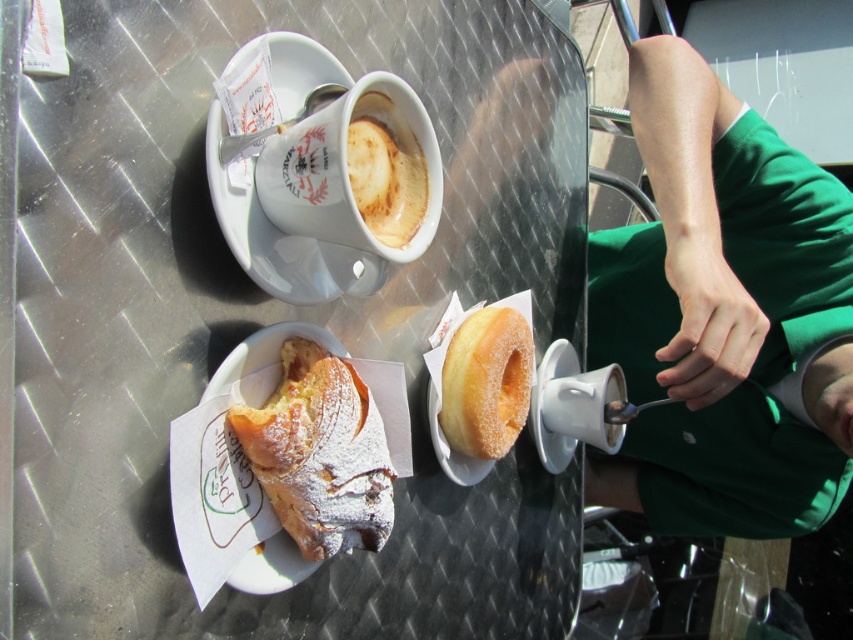
Who is positioned more to the left, metallic silver table at center or sugared doughnut at center?

Answer: From the viewer's perspective, metallic silver table at center appears more on the left side.

Describe the element at coordinates (274, 317) in the screenshot. Image resolution: width=853 pixels, height=640 pixels. I see `metallic silver table at center` at that location.

Describe the element at coordinates (274, 317) in the screenshot. The image size is (853, 640). I see `metallic silver table at center` at that location.

Where is `metallic silver table at center`? This screenshot has height=640, width=853. metallic silver table at center is located at coordinates (274, 317).

Can you confirm if powdered sugar croissant at lower left is bigger than sugared doughnut at center?

Yes.

Can you confirm if powdered sugar croissant at lower left is thinner than sugared doughnut at center?

In fact, powdered sugar croissant at lower left might be wider than sugared doughnut at center.

Does point (289, 515) lie in front of point (480, 392)?

Yes, it is in front of point (480, 392).

The height and width of the screenshot is (640, 853). Identify the location of powdered sugar croissant at lower left. (320, 452).

Consider the image. Between white ceramic saucer at upper left and white frothy coffee at upper center, which one has more height?

With more height is white ceramic saucer at upper left.

In the scene shown: Does white ceramic saucer at upper left have a greater height compared to white frothy coffee at upper center?

Yes.

What do you see at coordinates (262, 234) in the screenshot? Image resolution: width=853 pixels, height=640 pixels. I see `white ceramic saucer at upper left` at bounding box center [262, 234].

In order to click on white ceramic saucer at upper left in this screenshot , I will do `click(262, 234)`.